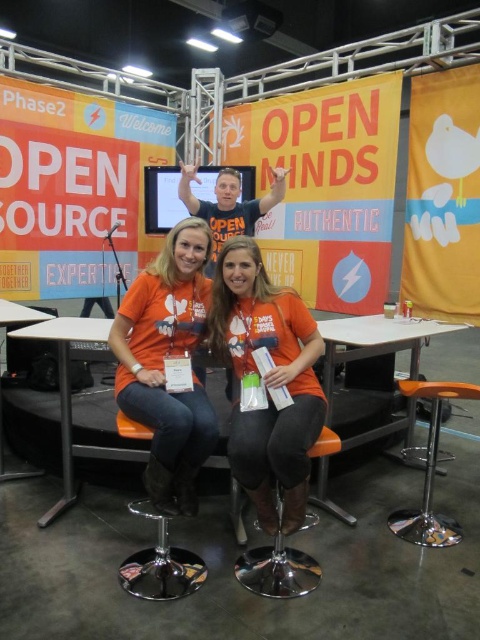
Question: Can you confirm if orange fabric shirt at center is bigger than matte black table at lower left?

Choices:
 (A) yes
 (B) no

Answer: (A)

Question: Which point appears closest to the camera in this image?

Choices:
 (A) (276, 464)
 (B) (38, 476)
 (C) (183, 387)
 (D) (38, 326)

Answer: (A)

Question: Is orange fabric shirt at center further to the viewer compared to orange plastic table at lower right?

Choices:
 (A) yes
 (B) no

Answer: (B)

Question: Which object is the closest to the white plastic table at center?

Choices:
 (A) orange fabric shirt at center
 (B) orange matte shirt at center

Answer: (B)

Question: Can you confirm if orange matte shirt at center is positioned to the left of orange plastic table at lower right?

Choices:
 (A) yes
 (B) no

Answer: (A)

Question: Which of these objects is positioned farthest from the matte black table at lower left?

Choices:
 (A) orange plastic table at lower right
 (B) orange matte shirt at center
 (C) orange plastic stool at lower right

Answer: (C)